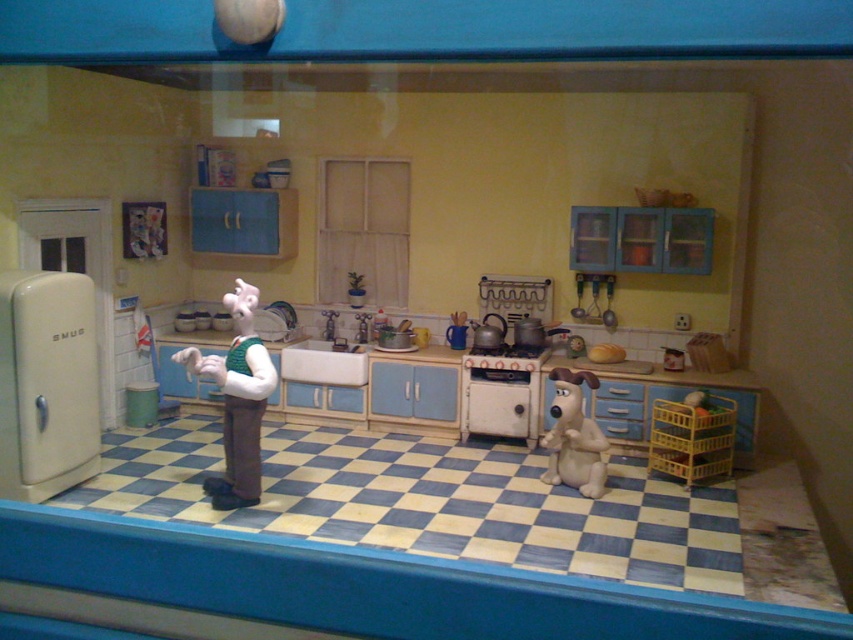
You are a tiny chef navigating the miniature kitchen scene. You need to locate the cream matte refrigerator at left. According to the coordinates provided, where exactly is it positioned in the image?

The cream matte refrigerator at left is positioned at the coordinates point (45, 384).

You are a child playing in the miniature kitchen scene. You see a white plush toy at center and a fuzzy beige dog at center. Which toy is sitting on top of the other?

The white plush toy at center is positioned over the fuzzy beige dog at center, so it is sitting on top of the fuzzy beige dog at center.

From the picture: You are a small toy that needs to be placed on the cream matte refrigerator at left. However, there is a fuzzy beige dog at center in the way. Can you move the toy to the refrigerator without moving the dog?

The cream matte refrigerator at left is positioned over the fuzzy beige dog at center, meaning the refrigerator is above the dog. Since the dog is below the refrigerator, you can safely place the toy on the refrigerator without disturbing the dog.